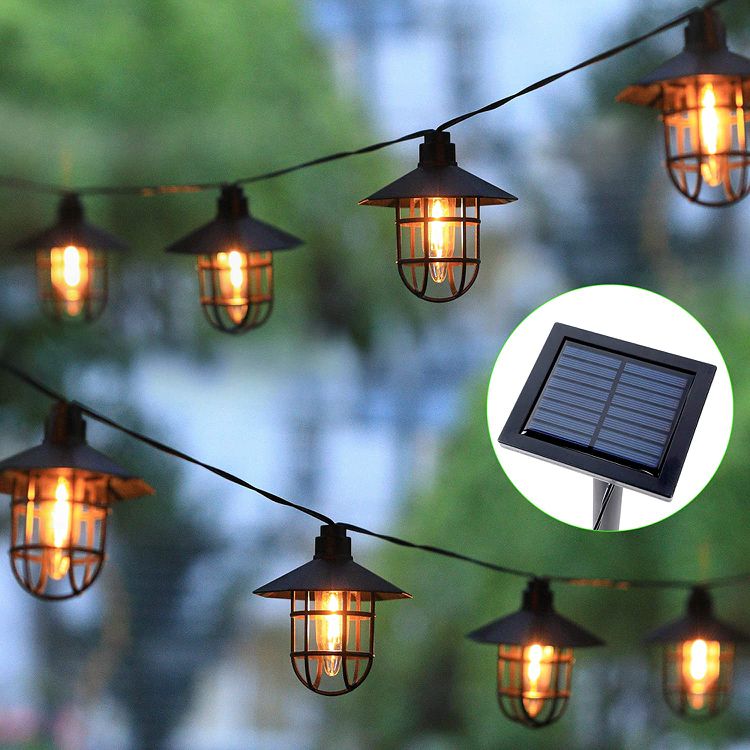
I want to click on mini cage holding light, so click(72, 591).